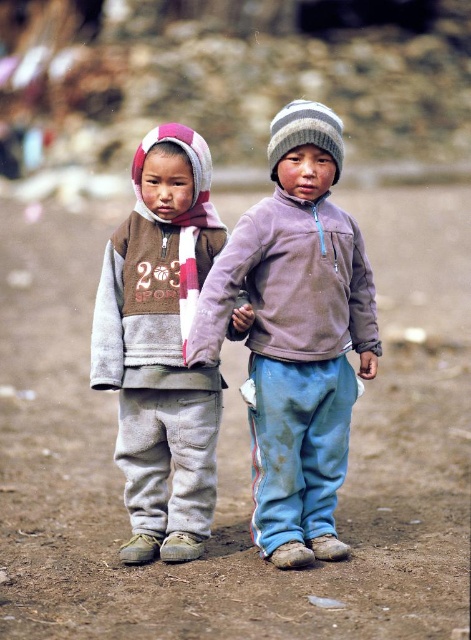
You are a fashion designer observing two garments in the image. The gray fleece jacket at left and the matte purple sweatshirt at center. Which one has a thicker fabric?

The matte purple sweatshirt at center has a thicker fabric than the gray fleece jacket at left.

Looking at this image, you are a photographer trying to capture a closeup of the light purple fleece jacket at center. You are currently positioned at the point marked by the coordinates point (297,333). Can you get a clear shot of the jacket without any obstructions?

The point (297,333) is on the light purple fleece jacket at center, so yes, you can get a clear shot of the jacket without any obstructions since you are already positioned on it.